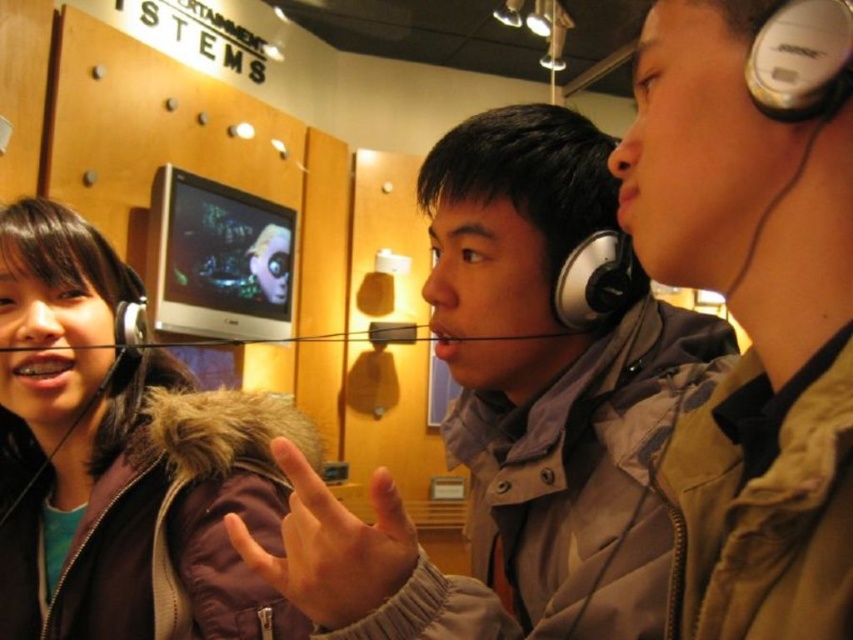
Can you confirm if brown fuzzy jacket at left is positioned to the left of matte silver earphone at left?

Correct, you'll find brown fuzzy jacket at left to the left of matte silver earphone at left.

Is point (183, 483) positioned behind point (119, 332)?

No.

Identify the location of brown fuzzy jacket at left. (122, 460).

Who is shorter, satin silver headphones at center or matte silver earphone at left?

Standing shorter between the two is matte silver earphone at left.

The width and height of the screenshot is (853, 640). What do you see at coordinates (595, 280) in the screenshot? I see `satin silver headphones at center` at bounding box center [595, 280].

Is point (584, 304) less distant than point (126, 330)?

Yes, it is in front of point (126, 330).

Identify the location of satin silver headphones at center. (595, 280).

Consider the image. Is brown fuzzy jacket at left wider than satin silver headphones at center?

Yes, brown fuzzy jacket at left is wider than satin silver headphones at center.

Who is more forward, [49,525] or [581,250]?

Point [581,250] is more forward.

Which is in front, point (164, 467) or point (566, 282)?

Positioned in front is point (566, 282).

What are the coordinates of `brown fuzzy jacket at left` in the screenshot? It's located at (122, 460).